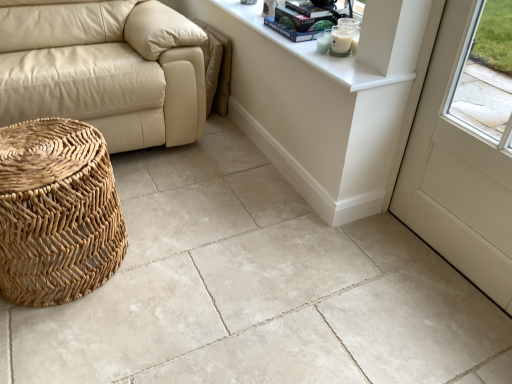
Question: From the image's perspective, is beige leather couch at left located above hardcover book at upper center, which is counted as the 2th book, starting from the bottom?

Choices:
 (A) yes
 (B) no

Answer: (B)

Question: Considering the relative sizes of beige leather couch at left and hardcover book at upper center, the first book from the top, in the image provided, is beige leather couch at left thinner than hardcover book at upper center, the first book from the top,?

Choices:
 (A) no
 (B) yes

Answer: (A)

Question: Does beige leather couch at left have a greater width compared to hardcover book at upper center, which is counted as the 2th book, starting from the bottom?

Choices:
 (A) no
 (B) yes

Answer: (B)

Question: Would you say beige leather couch at left is outside hardcover book at upper center, the first book from the top?

Choices:
 (A) yes
 (B) no

Answer: (A)

Question: From a real-world perspective, is beige leather couch at left below hardcover book at upper center, the first book from the top?

Choices:
 (A) yes
 (B) no

Answer: (A)

Question: Does beige leather couch at left appear on the left side of hardcover book at upper center, the first book from the top?

Choices:
 (A) no
 (B) yes

Answer: (B)

Question: Is white glossy counter top at upper right taller than hardcover book at upper center, which is counted as the 2th book, starting from the bottom?

Choices:
 (A) yes
 (B) no

Answer: (B)

Question: Considering the relative positions of white glossy counter top at upper right and hardcover book at upper center, which is counted as the 2th book, starting from the bottom, in the image provided, is white glossy counter top at upper right to the right of hardcover book at upper center, which is counted as the 2th book, starting from the bottom, from the viewer's perspective?

Choices:
 (A) no
 (B) yes

Answer: (A)

Question: Is white glossy counter top at upper right bigger than hardcover book at upper center, the first book from the top?

Choices:
 (A) yes
 (B) no

Answer: (A)

Question: Is white glossy counter top at upper right turned away from hardcover book at upper center, the first book from the top?

Choices:
 (A) yes
 (B) no

Answer: (B)

Question: Does white glossy counter top at upper right appear on the left side of hardcover book at upper center, the first book from the top?

Choices:
 (A) yes
 (B) no

Answer: (A)

Question: Is white glossy counter top at upper right oriented towards hardcover book at upper center, the first book from the top?

Choices:
 (A) yes
 (B) no

Answer: (B)

Question: From the image's perspective, does white glossy counter top at upper right appear higher than white glossy table at upper center?

Choices:
 (A) no
 (B) yes

Answer: (B)